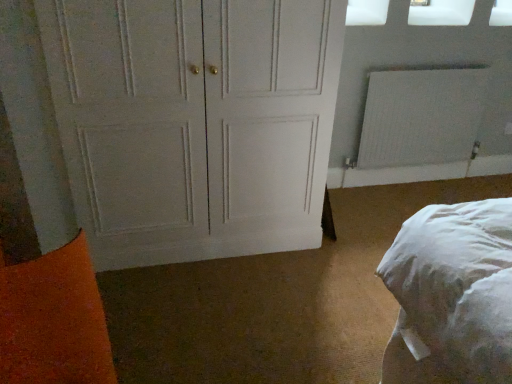
What are the coordinates of `free space in front of white textured radiator at upper right` in the screenshot? It's located at (406, 201).